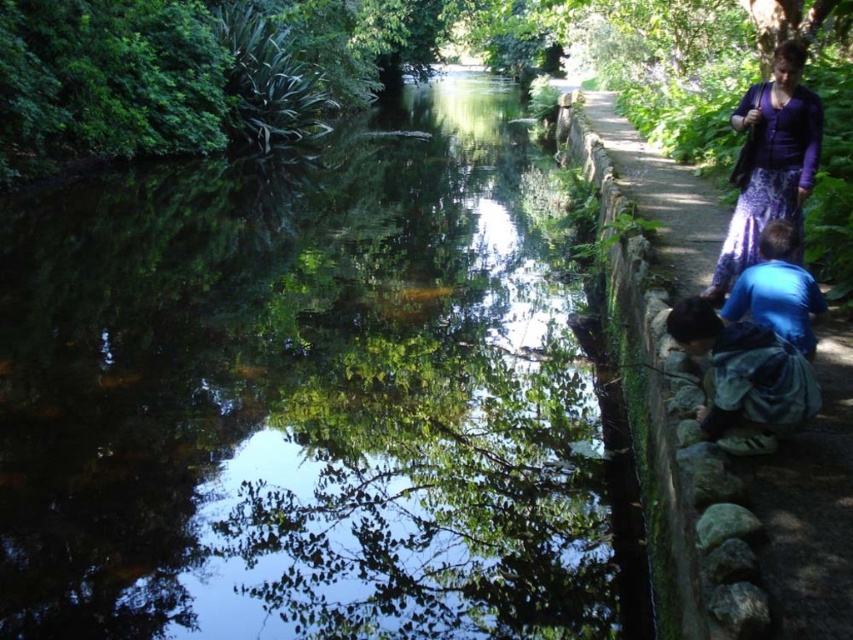
Question: Considering the relative positions of green mossy stone path at right and purple fabric skirt at upper right in the image provided, where is green mossy stone path at right located with respect to purple fabric skirt at upper right?

Choices:
 (A) right
 (B) left

Answer: (A)

Question: Which of the following is the farthest from the observer?

Choices:
 (A) [666, 266]
 (B) [463, 166]
 (C) [817, 392]

Answer: (B)

Question: Is clear water at center further to the viewer compared to green mossy stone path at right?

Choices:
 (A) no
 (B) yes

Answer: (B)

Question: Does purple fabric skirt at upper right come in front of blue matte shirt at lower right?

Choices:
 (A) no
 (B) yes

Answer: (A)

Question: Which point is farther to the camera?

Choices:
 (A) (834, 582)
 (B) (776, 298)
 (C) (277, 614)
 (D) (717, 372)

Answer: (B)

Question: Which is farther from the blue matte shirt at lower right?

Choices:
 (A) blue denim jacket at lower right
 (B) green mossy stone path at right
 (C) clear water at center
 (D) purple fabric skirt at upper right

Answer: (C)